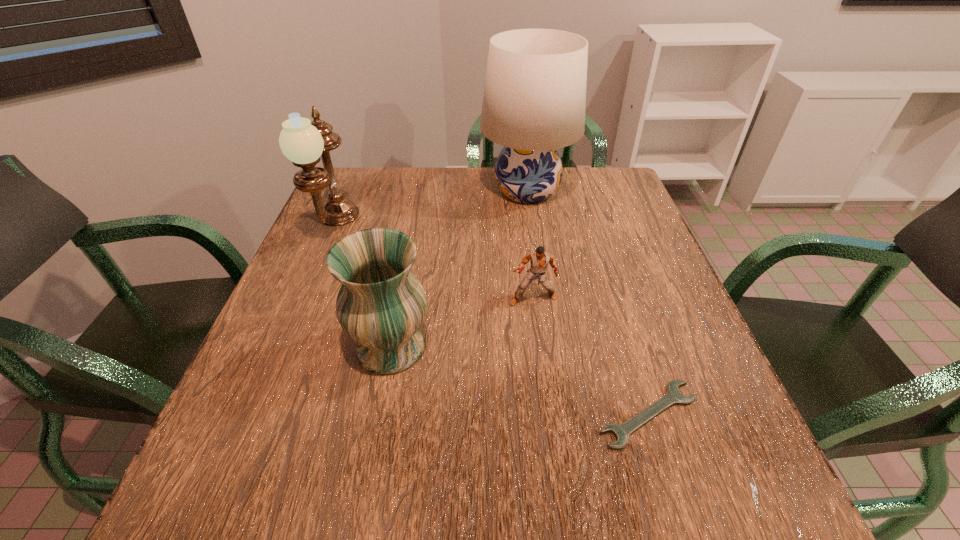
You are a GUI agent. You are given a task and a screenshot of the screen. Output one action in this format:
    pyautogui.click(x=<x>, y=<y>)
    Task: Click on the object situated at the far left corner
    This screenshot has height=540, width=960.
    Given the screenshot: What is the action you would take?
    pyautogui.click(x=303, y=142)

Where is `free space at the far edge`? The width and height of the screenshot is (960, 540). free space at the far edge is located at coordinates (469, 195).

In order to click on vacant area at the near edge of the desktop in this screenshot , I will do `click(522, 507)`.

Where is `vacant region at the left edge`? The image size is (960, 540). vacant region at the left edge is located at coordinates tap(267, 406).

In the image, there is a desktop. At what (x,y) coordinates should I click in order to perform the action: click on vacant space at the right edge. Please return your answer as a coordinate pair (x, y). The width and height of the screenshot is (960, 540). Looking at the image, I should click on (687, 374).

Where is `vacant space at the near left corner of the desktop`? This screenshot has width=960, height=540. vacant space at the near left corner of the desktop is located at coordinates (285, 519).

In the image, there is a desktop. At what (x,y) coordinates should I click in order to perform the action: click on free space at the far right corner. Please return your answer as a coordinate pair (x, y). The image size is (960, 540). Looking at the image, I should click on (588, 187).

Locate an element on the screen. vacant area that lies between the lampshade and the leftmost object is located at coordinates (431, 210).

Image resolution: width=960 pixels, height=540 pixels. I want to click on unoccupied position between the tallest object and the leftmost object, so click(431, 210).

Where is `blank region between the tallest object and the second shortest object`? The image size is (960, 540). blank region between the tallest object and the second shortest object is located at coordinates (530, 245).